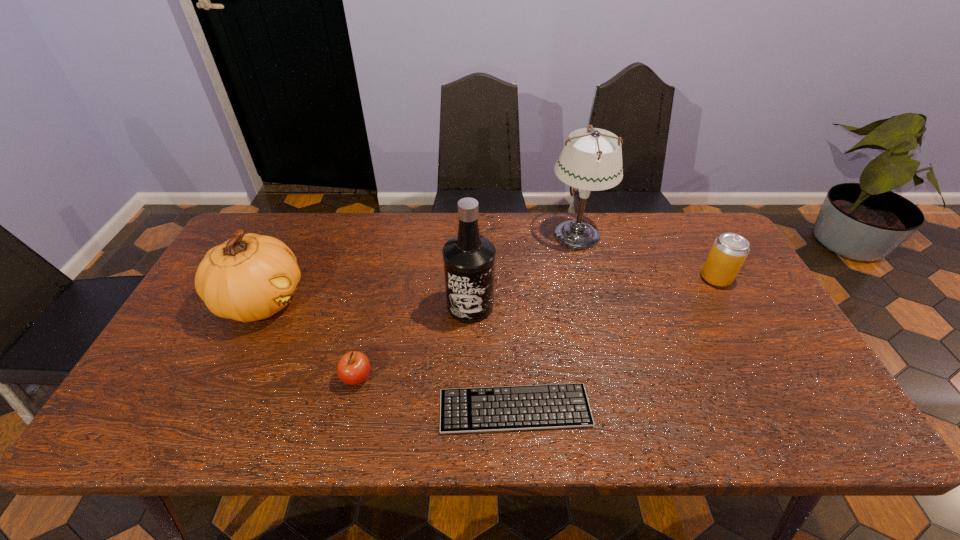
Identify the location of free point that satisfies the following two spatial constraints: 1. on the back side of the apple; 2. on the front face of the pumpkin. This screenshot has height=540, width=960. (374, 301).

Identify the location of vacant position in the image that satisfies the following two spatial constraints: 1. on the lampshade of the farthest object; 2. on the front side of the shortest object. This screenshot has width=960, height=540. (620, 408).